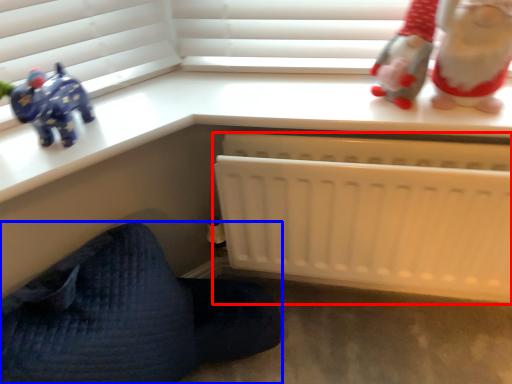
Question: Which of the following is the farthest to the observer, infant bed (highlighted by a red box) or furniture (highlighted by a blue box)?

Choices:
 (A) infant bed
 (B) furniture

Answer: (A)